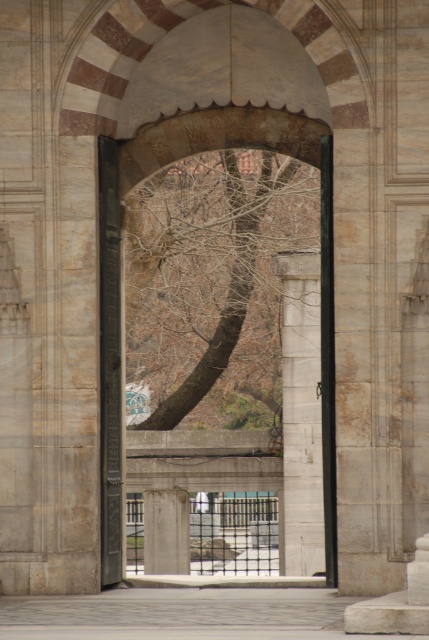
You are standing in front of the grand entrance and notice a bare wood tree at center and a white stone pillar at center. Which object is shorter?

The bare wood tree at center is not as tall as the white stone pillar at center, so the bare wood tree at center is shorter.

You are an architect examining the entrance of a historical building. You notice two pillars at the center. One is labeled as white stone pillar at center and the other as white marble pillar at center. Which pillar is wider?

The white stone pillar at center is wider than the white marble pillar at center.

You are an architect examining the entrance of this building. You notice two pillars at the center. Which one is closer to you, the white stone pillar at center or the white marble pillar at center?

The white stone pillar at center is closer to you because it is in front of the white marble pillar at center.